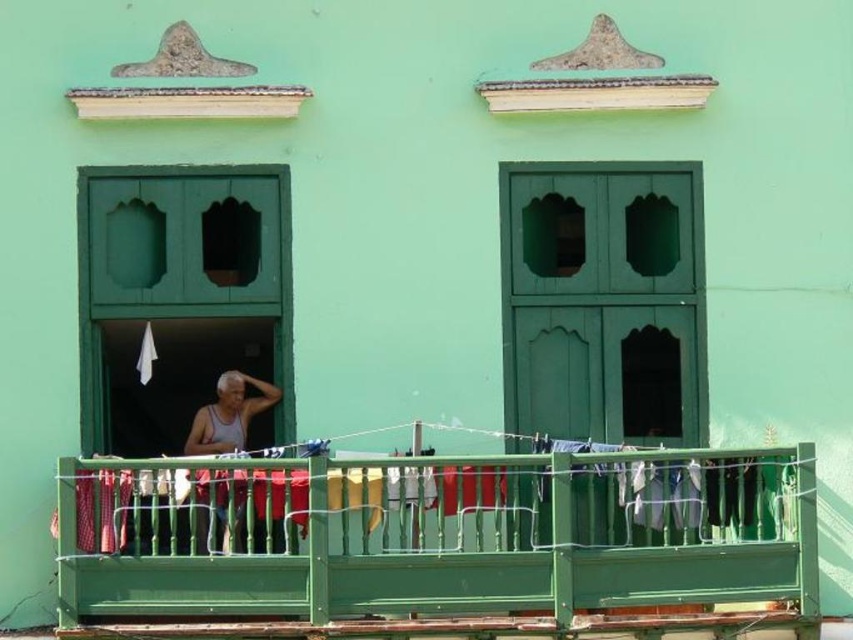
Question: Can you confirm if green wooden railing at center is bigger than white tank top at center?

Choices:
 (A) yes
 (B) no

Answer: (A)

Question: Is green wooden railing at center to the left of white tank top at center from the viewer's perspective?

Choices:
 (A) yes
 (B) no

Answer: (B)

Question: Which object is farther from the camera taking this photo?

Choices:
 (A) white tank top at center
 (B) green wooden railing at center

Answer: (A)

Question: Does green wooden railing at center have a smaller size compared to white tank top at center?

Choices:
 (A) yes
 (B) no

Answer: (B)

Question: Among these objects, which one is nearest to the camera?

Choices:
 (A) white tank top at center
 (B) green wooden railing at center

Answer: (B)